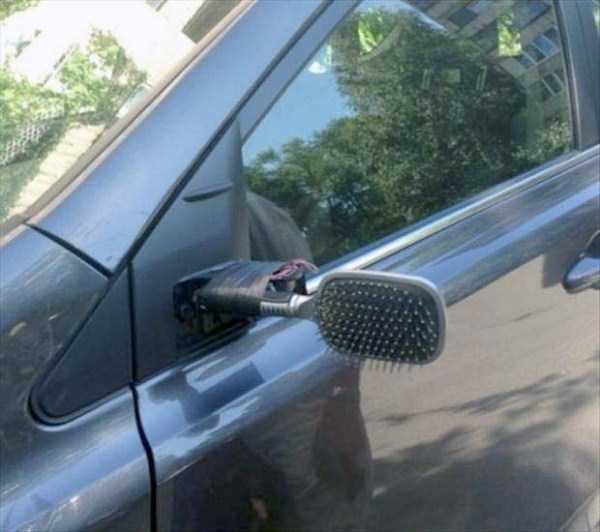
What are the coordinates of `hair brush` in the screenshot? It's located at (375, 327).